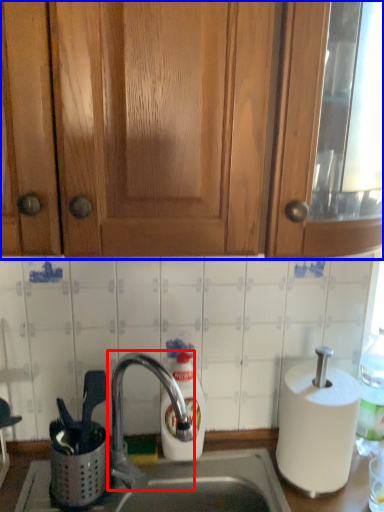
Question: Among these objects, which one is nearest to the camera, tap (highlighted by a red box) or cabinetry (highlighted by a blue box)?

Choices:
 (A) tap
 (B) cabinetry

Answer: (B)